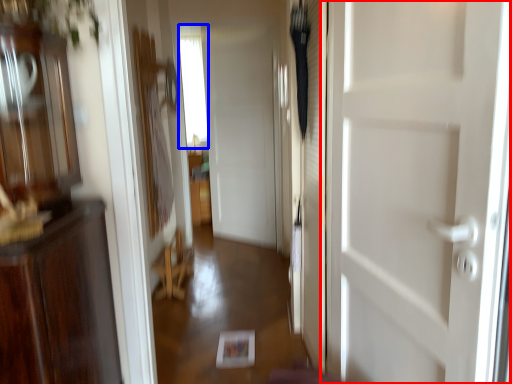
Question: Which point is closer to the camera, door (highlighted by a red box) or window (highlighted by a blue box)?

Choices:
 (A) door
 (B) window

Answer: (A)